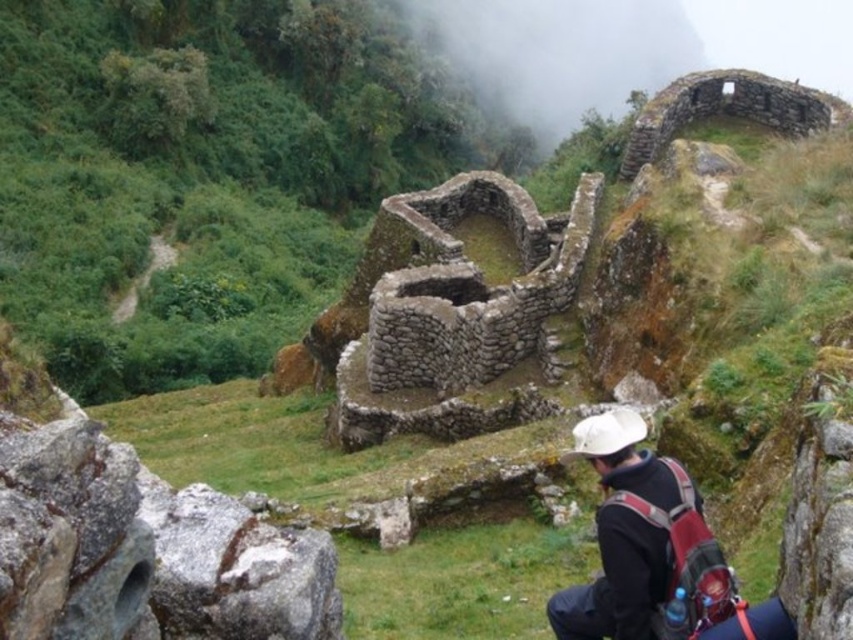
How distant is foggy stone wall at upper center from black fabric backpack at lower right?

foggy stone wall at upper center is 264.31 meters away from black fabric backpack at lower right.

Is foggy stone wall at upper center bigger than black fabric backpack at lower right?

Correct, foggy stone wall at upper center is larger in size than black fabric backpack at lower right.

Who is more distant from viewer, [503,109] or [618,433]?

Point [503,109]

Find the location of `foggy stone wall at upper center`. foggy stone wall at upper center is located at coordinates (556, 52).